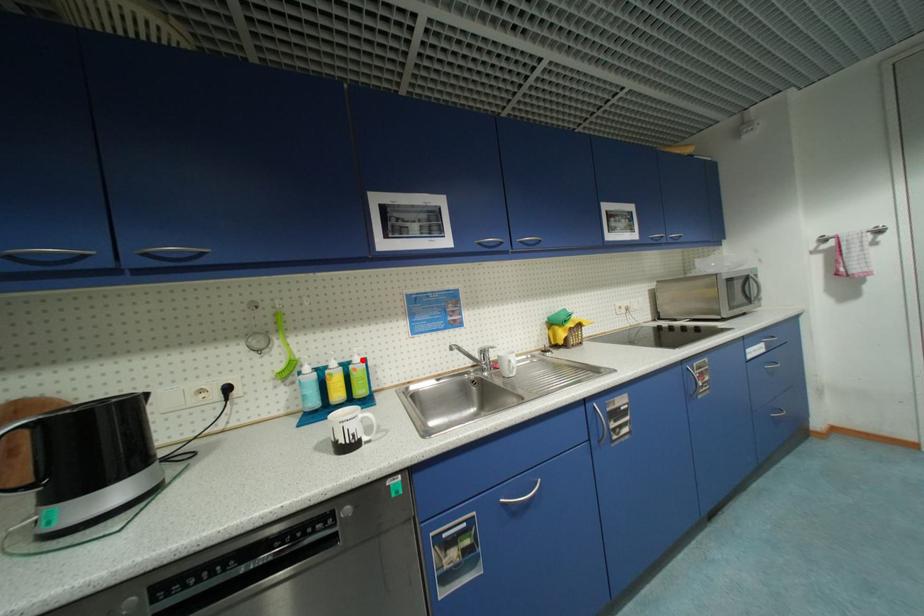
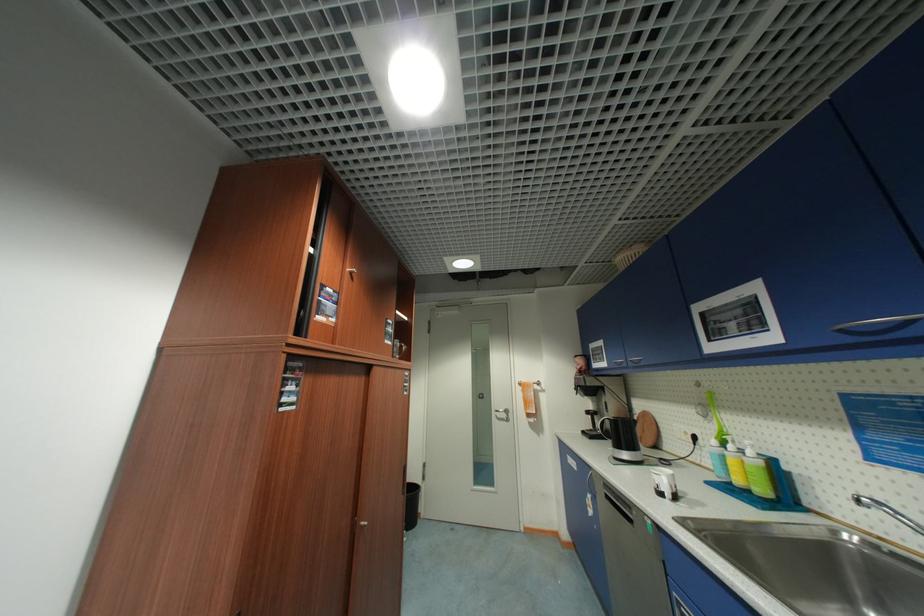
In the second image, find the point that corresponds to the highlighted location in the first image.

(756, 454)